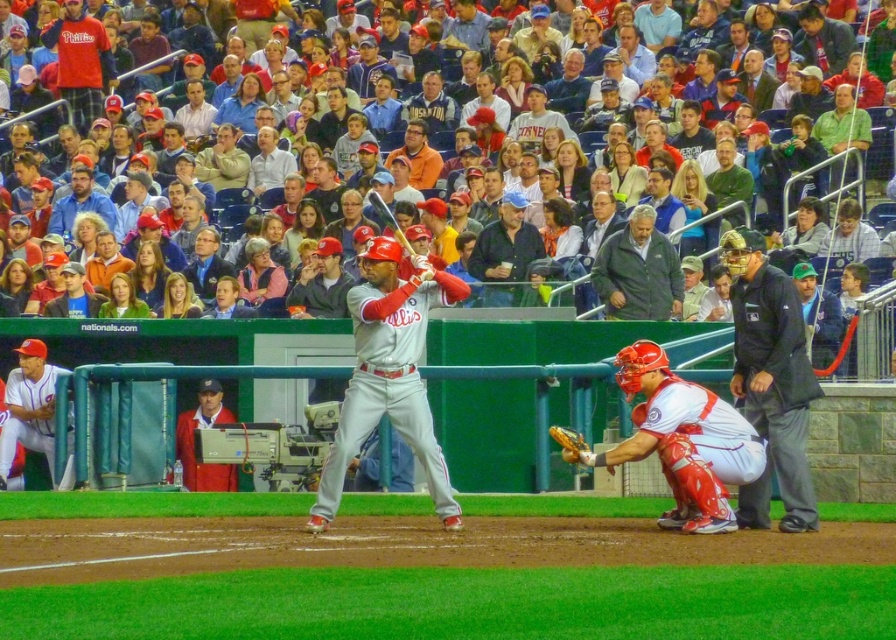
Question: Is white matte uniform at lower right thinner than matte red shirt at upper left?

Choices:
 (A) yes
 (B) no

Answer: (B)

Question: Which point appears farthest from the camera in this image?

Choices:
 (A) (384, 204)
 (B) (746, 477)
 (C) (204, 484)
 (D) (2, 451)

Answer: (A)

Question: In this image, where is black fabric umpire at right located relative to orange cotton shirt at upper center?

Choices:
 (A) right
 (B) left

Answer: (A)

Question: Can you confirm if matte gray uniform at center is smaller than red jacket at lower left?

Choices:
 (A) yes
 (B) no

Answer: (B)

Question: Based on their relative distances, which object is nearer to the green matte shirt at center?

Choices:
 (A) green fabric cap at upper right
 (B) gray fleece jacket at upper center
 (C) yellow leather glove at lower right
 (D) black fabric umpire at right

Answer: (B)

Question: Which of the following is the farthest from the observer?

Choices:
 (A) (662, 292)
 (B) (510, 250)
 (C) (20, 387)

Answer: (B)